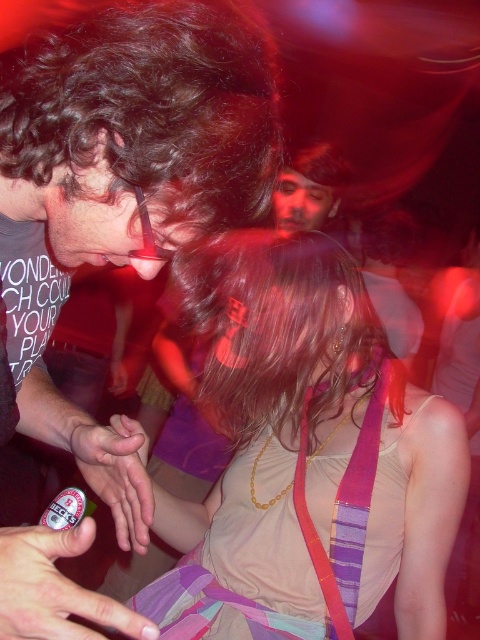
You are a photographer trying to capture a candid shot of the two people in the scene. You need to ensure that both the matte black shirt at center and the purple striped strap at center are in focus. Given that your camera has a depth of field that can cover 18 inches, will you be able to get both objects in focus?

The matte black shirt at center and the purple striped strap at center are 17.14 inches apart. Since the camera can cover 18 inches, both objects will be within the depth of field and thus in focus.

You are at a party with a vibrant red light. You see a person on the left with curly dark hair and glasses holding a small object, and a person on the right with long wavy brown hair wearing a sleeveless beige top with a colorful striped sash. There is a point marked at coordinates (312, 432). What does this point indicate?

The point at coordinates (312, 432) indicates the location of the matte beige tank top at center.

You are at a party and see the matte black shirt at center and the purple striped strap at center. Which one is closer to you?

The matte black shirt at center is positioned over the purple striped strap at center, so it is closer to you.